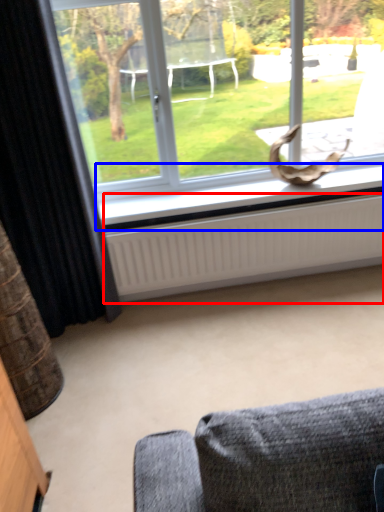
Question: Which object is further to the camera taking this photo, radiator (highlighted by a red box) or window sill (highlighted by a blue box)?

Choices:
 (A) radiator
 (B) window sill

Answer: (B)